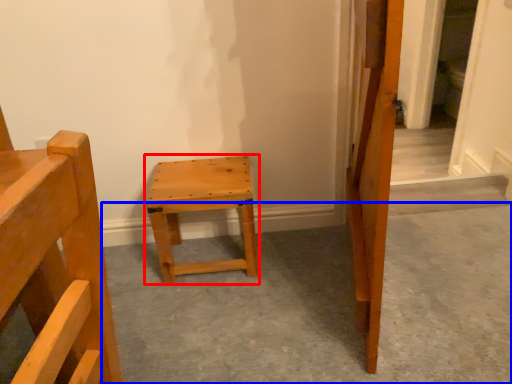
Question: Which object is closer to the camera taking this photo, stool (highlighted by a red box) or concrete (highlighted by a blue box)?

Choices:
 (A) stool
 (B) concrete

Answer: (B)